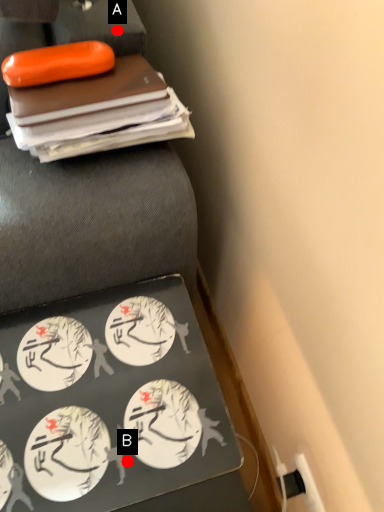
Question: Two points are circled on the image, labeled by A and B beside each circle. Which point is closer to the camera?

Choices:
 (A) A is closer
 (B) B is closer

Answer: (B)